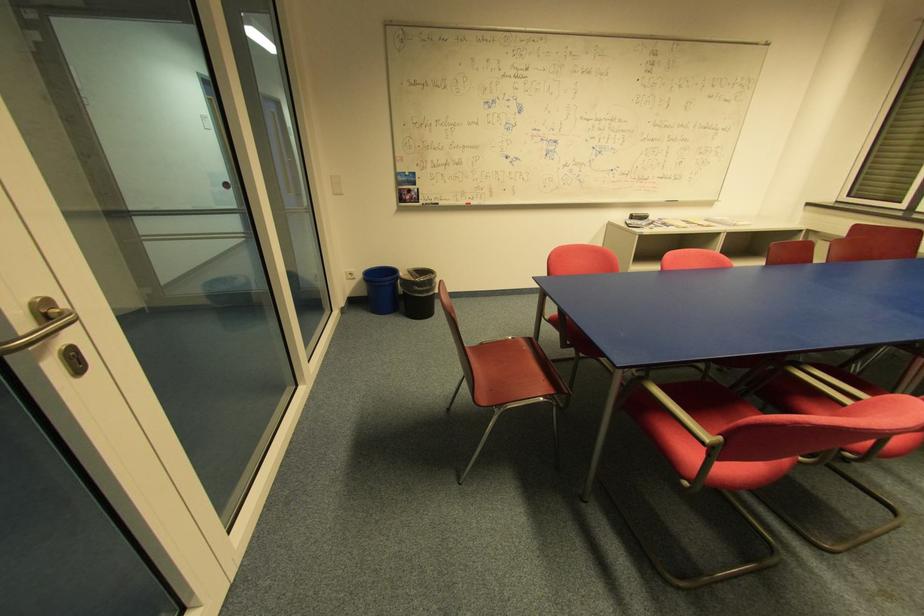
What do you see at coordinates (335, 185) in the screenshot? I see `the white light switch` at bounding box center [335, 185].